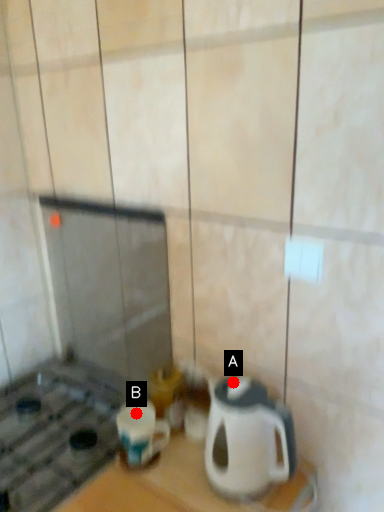
Question: Two points are circled on the image, labeled by A and B beside each circle. Which point is further to the camera?

Choices:
 (A) A is further
 (B) B is further

Answer: (B)